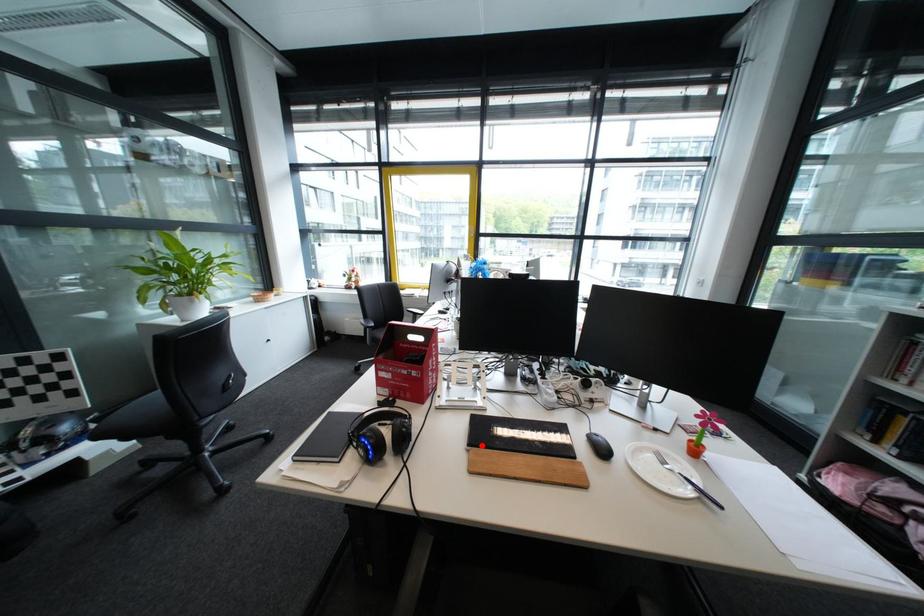
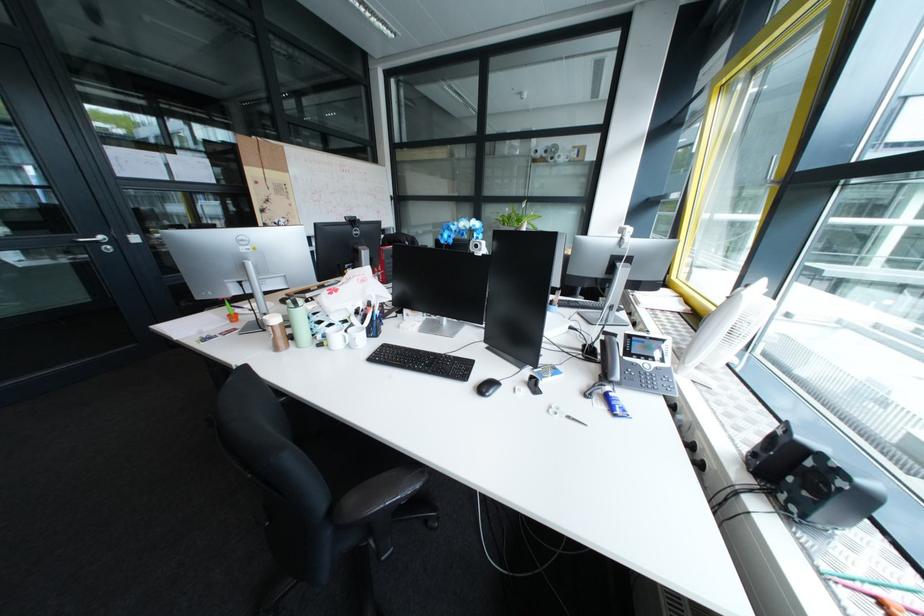
Question: I am providing you with two images of the same scene from different viewpoints. A red point is marked on the first image. Is the red point's position out of view in image 2?

Choices:
 (A) Yes
 (B) No

Answer: (A)